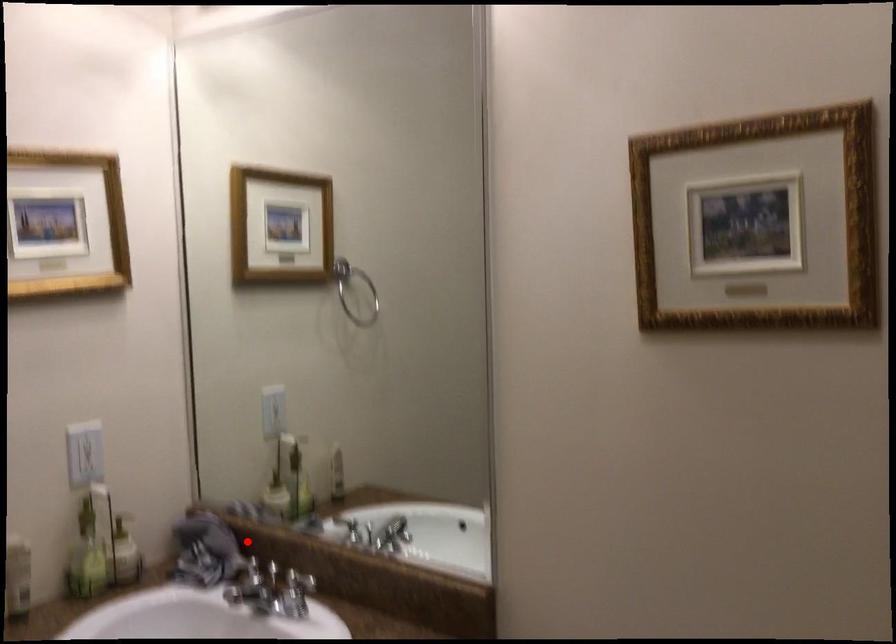
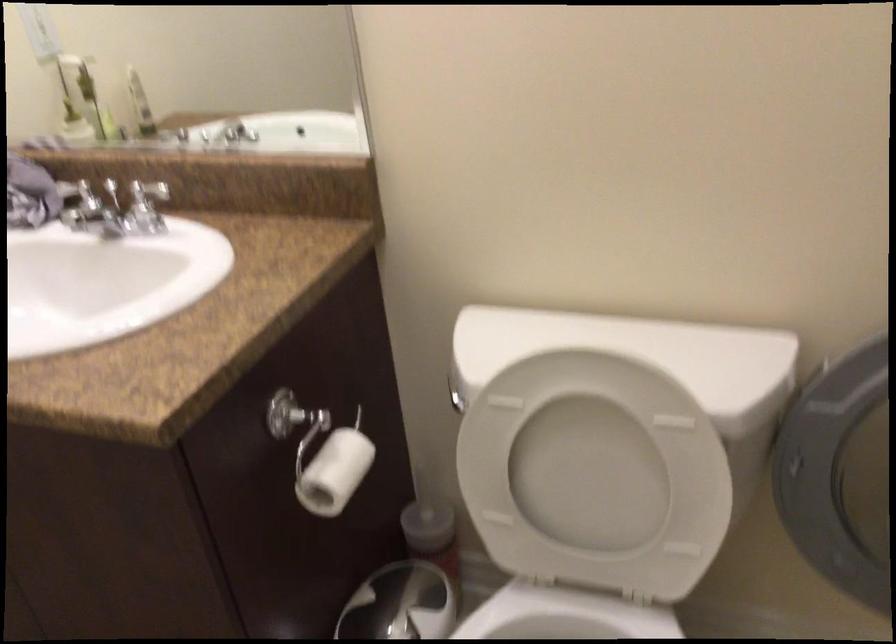
Question: I am providing you with two images of the same scene from different viewpoints. A red point is shown in image1. For the corresponding object point in image2, is it positioned nearer or farther from the camera?

Choices:
 (A) Nearer
 (B) Farther

Answer: (A)